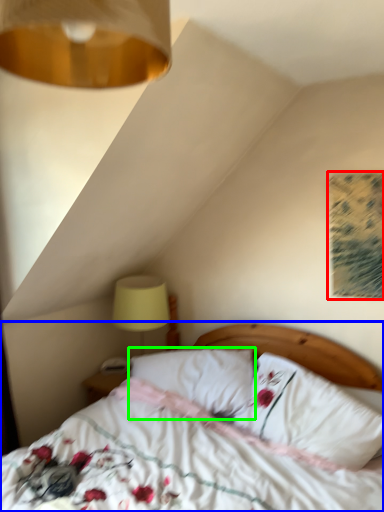
Question: Based on their relative distances, which object is farther from print (highlighted by a red box)? Choose from bed (highlighted by a blue box) and pillow (highlighted by a green box).

Choices:
 (A) bed
 (B) pillow

Answer: (A)